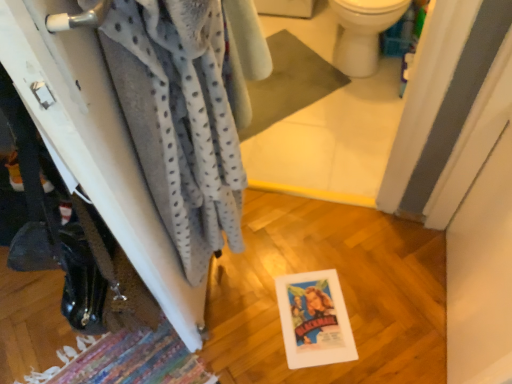
The image size is (512, 384). What do you see at coordinates (96, 146) in the screenshot?
I see `gray fabric at left` at bounding box center [96, 146].

Where is `gray fabric at left`? The height and width of the screenshot is (384, 512). gray fabric at left is located at coordinates (96, 146).

Locate an element on the screen. The image size is (512, 384). gray fabric at left is located at coordinates (96, 146).